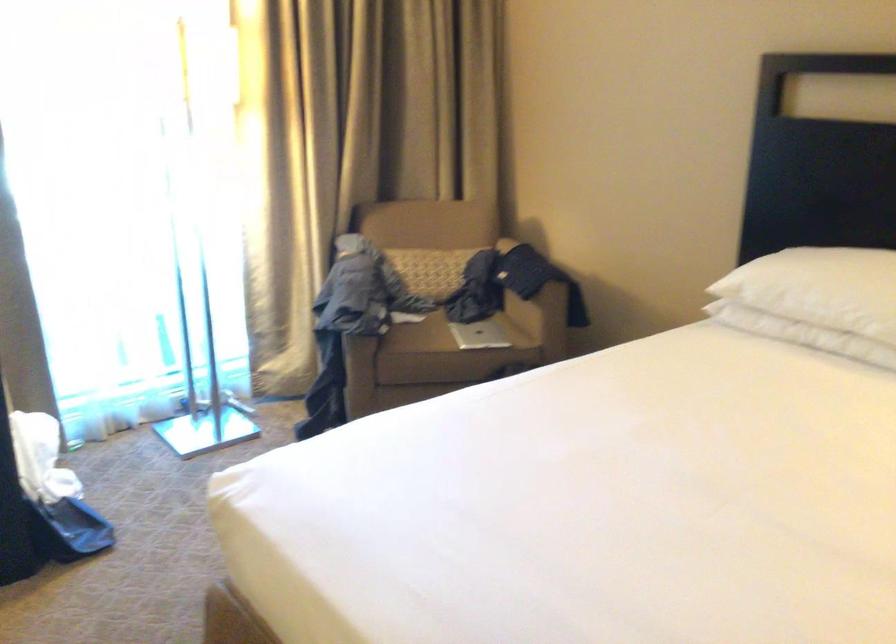
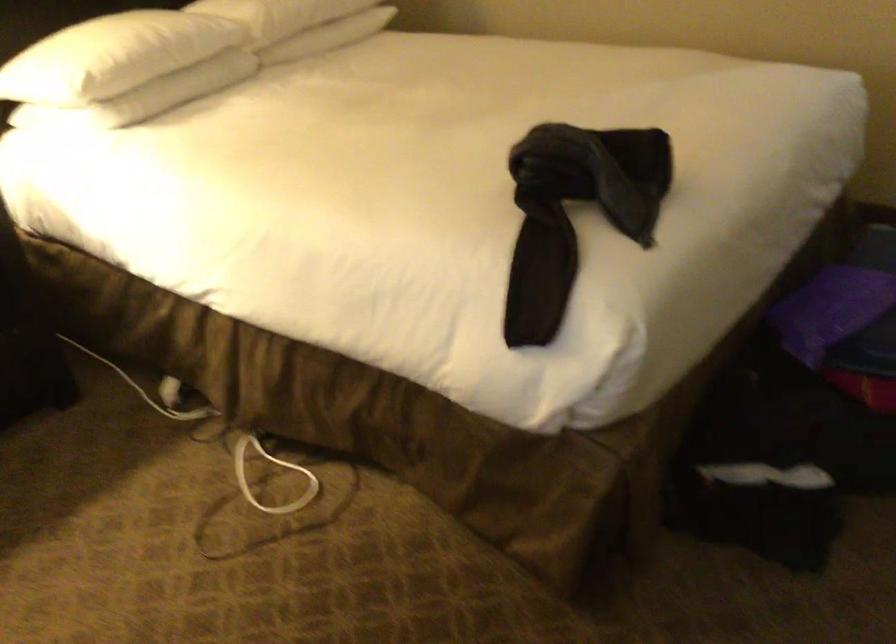
In the scene shown: The first image is from the beginning of the video and the second image is from the end. How did the camera likely rotate when shooting the video?

The camera's rotation is toward right-down.